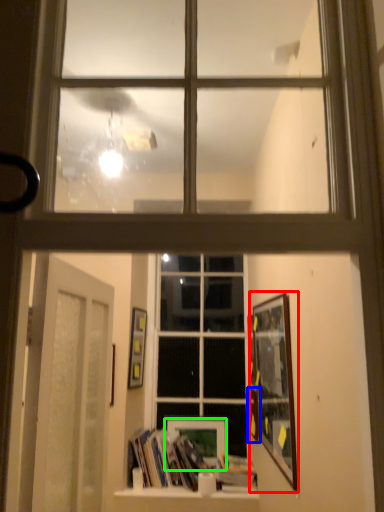
Question: Estimate the real-world distances between objects in this image. Which object is closer to picture frame (highlighted by a red box), picture frame (highlighted by a blue box) or picture frame (highlighted by a green box)?

Choices:
 (A) picture frame
 (B) picture frame

Answer: (A)